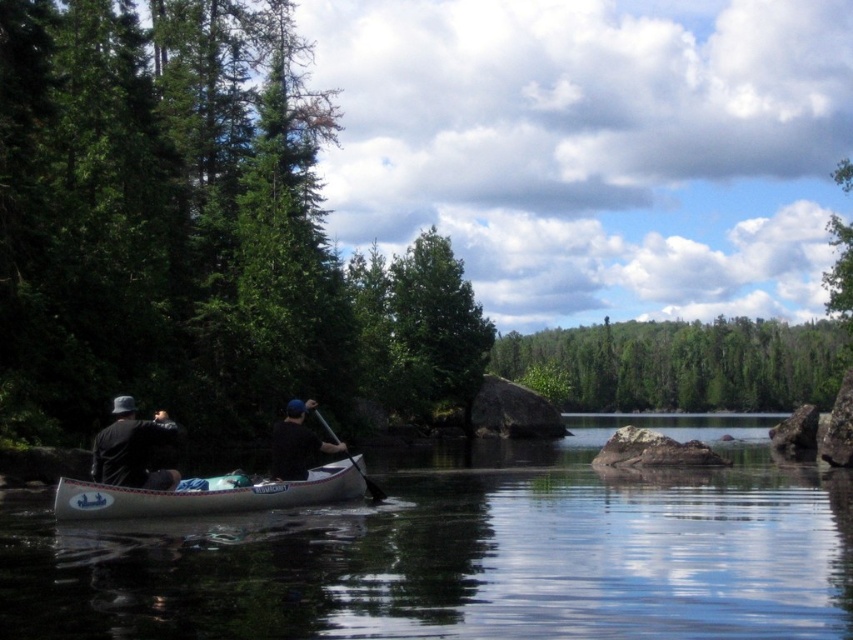
Question: Which point is farther to the camera?

Choices:
 (A) black matte paddle at center
 (B) green leafy forest at center
 (C) white plastic canoe at center

Answer: (B)

Question: Based on their relative distances, which object is farther from the dark gray hat at left?

Choices:
 (A) green leafy tree at center
 (B) wooden smooth paddle at center
 (C) white plastic canoe at center

Answer: (A)

Question: Which of the following is the farthest from the observer?

Choices:
 (A) green leafy forest at center
 (B) white plastic canoe at center

Answer: (A)

Question: Is green leafy tree at center to the right of black matte paddle at center from the viewer's perspective?

Choices:
 (A) no
 (B) yes

Answer: (B)

Question: Is green leafy tree at center to the left of dark gray hat at left from the viewer's perspective?

Choices:
 (A) no
 (B) yes

Answer: (A)

Question: Can you confirm if green leafy forest at center is positioned to the right of black matte paddle at center?

Choices:
 (A) yes
 (B) no

Answer: (A)